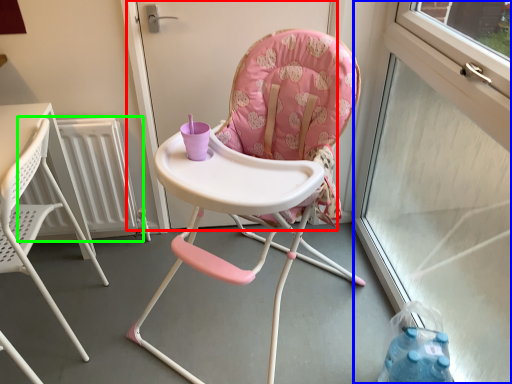
Question: Which object is positioned closest to screen door (highlighted by a red box)? Select from window screen (highlighted by a blue box) and radiator (highlighted by a green box).

Choices:
 (A) window screen
 (B) radiator

Answer: (B)